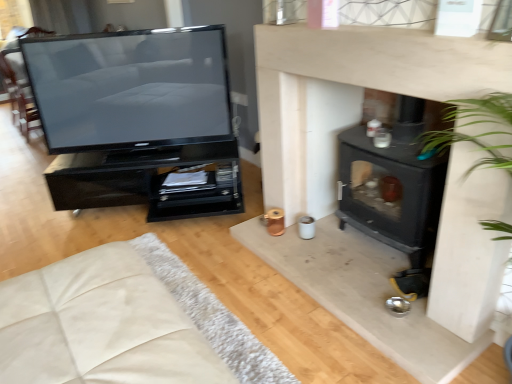
Question: Does point (393, 132) appear closer or farther from the camera than point (147, 279)?

Choices:
 (A) farther
 (B) closer

Answer: (A)

Question: Based on their sizes in the image, would you say black matte wood burning stove at center-right is bigger or smaller than beige fabric couch at lower left?

Choices:
 (A) big
 (B) small

Answer: (B)

Question: Which is nearer to the beige fabric couch at lower left?

Choices:
 (A) black glossy tv stand at left
 (B) black matte wood burning stove at center-right
 (C) matte black television at left

Answer: (B)

Question: Based on their relative distances, which object is farther from the black matte wood burning stove at center-right?

Choices:
 (A) beige fabric couch at lower left
 (B) black glossy tv stand at left
 (C) matte black television at left

Answer: (C)